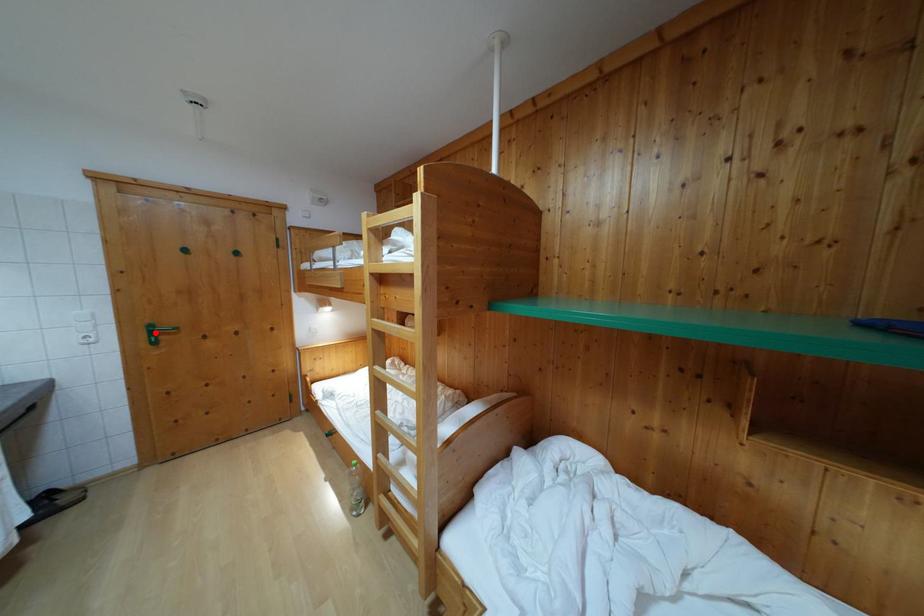
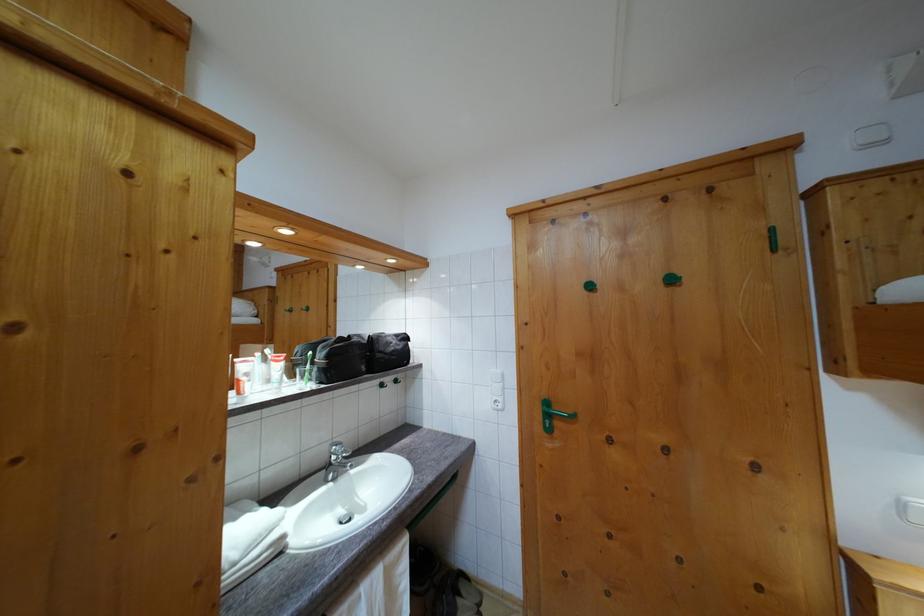
Where in the second image is the point corresponding to the highlighted location from the first image?

(551, 410)